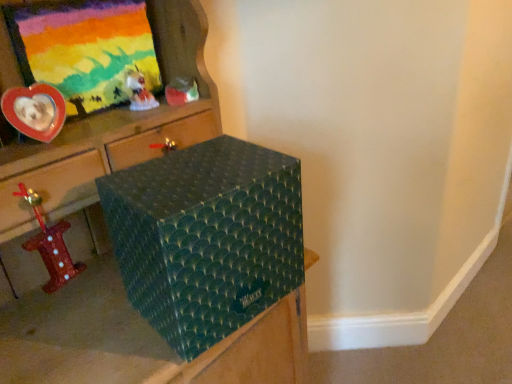
Describe the element at coordinates (50, 244) in the screenshot. I see `metallic red number one at left, positioned as the third toy in right-to-left order` at that location.

What is the approximate height of matte plastic toy at upper center, placed as the third toy when sorted from bottom to top?

matte plastic toy at upper center, placed as the third toy when sorted from bottom to top, is 1.97 inches tall.

In order to face matte plastic toy at upper center, placed as the third toy when sorted from bottom to top, should I rotate leftwards or rightwards?

It's best to rotate left around 9.557 degrees.

Image resolution: width=512 pixels, height=384 pixels. In order to click on translucent plastic figurine at upper center, which ranks as the second toy in left-to-right order in this screenshot , I will do `click(138, 91)`.

How much space does translucent plastic figurine at upper center, the 2th toy positioned from the back, occupy horizontally?

It is 2.09 inches.

Find the location of `green textured box at center`. green textured box at center is located at coordinates (166, 244).

You are a GUI agent. You are given a task and a screenshot of the screen. Output one action in this format:
    pyautogui.click(x=<x>, y=<y>)
    Task: Click on the teal textured box at center
    This screenshot has height=384, width=512.
    Given the screenshot: What is the action you would take?
    pyautogui.click(x=206, y=237)

Are matte plastic toy at upper center, placed as the 3th toy when sorted from front to back, and metallic red number one at left, positioned as the third toy in right-to-left order, beside each other?

No, matte plastic toy at upper center, placed as the 3th toy when sorted from front to back, is not next to metallic red number one at left, positioned as the third toy in right-to-left order.

Is matte plastic toy at upper center, positioned as the 3th toy in left-to-right order, taller or shorter than metallic red number one at left, arranged as the 3th toy when viewed from the back?

In the image, matte plastic toy at upper center, positioned as the 3th toy in left-to-right order, appears to be shorter than metallic red number one at left, arranged as the 3th toy when viewed from the back.

Is point (173, 88) closer or farther from the camera than point (66, 223)?

Clearly, point (173, 88) is more distant from the camera than point (66, 223).

Considering the relative sizes of matte plastic picture frame at upper left and teal textured box at center in the image provided, is matte plastic picture frame at upper left bigger than teal textured box at center?

Actually, matte plastic picture frame at upper left might be smaller than teal textured box at center.

Is matte plastic picture frame at upper left not close to teal textured box at center?

No, matte plastic picture frame at upper left is in close proximity to teal textured box at center.

Would you say teal textured box at center is part of matte plastic picture frame at upper left's contents?

That's incorrect, teal textured box at center is not inside matte plastic picture frame at upper left.

Is matte plastic picture frame at upper left positioned with its back to teal textured box at center?

No, matte plastic picture frame at upper left's orientation is not away from teal textured box at center.

Is green textured box at center with matte plastic toy at upper center, placed as the first toy when sorted from back to front?

No, green textured box at center is not touching matte plastic toy at upper center, placed as the first toy when sorted from back to front.

How far apart are green textured box at center and matte plastic toy at upper center, placed as the 3th toy when sorted from front to back?

13.93 inches.

Is matte plastic toy at upper center, which is the first toy in right-to-left order, a part of green textured box at center?

Absolutely, matte plastic toy at upper center, which is the first toy in right-to-left order, is inside green textured box at center.

Consider the image. Considering the sizes of green textured box at center and matte plastic toy at upper center, which is counted as the 1th toy, starting from the top, in the image, is green textured box at center wider or thinner than matte plastic toy at upper center, which is counted as the 1th toy, starting from the top,?

Considering their sizes, green textured box at center looks broader than matte plastic toy at upper center, which is counted as the 1th toy, starting from the top.

Is translucent plastic figurine at upper center, which appears as the second toy when viewed from the top, not inside matte plastic toy at upper center, which is counted as the 1th toy, starting from the top?

Yes, translucent plastic figurine at upper center, which appears as the second toy when viewed from the top, is outside of matte plastic toy at upper center, which is counted as the 1th toy, starting from the top.

Considering the positions of objects translucent plastic figurine at upper center, the 2th toy positioned from the back, and matte plastic toy at upper center, which is counted as the 1th toy, starting from the top, in the image provided, who is more to the right, translucent plastic figurine at upper center, the 2th toy positioned from the back, or matte plastic toy at upper center, which is counted as the 1th toy, starting from the top,?

From the viewer's perspective, matte plastic toy at upper center, which is counted as the 1th toy, starting from the top, appears more on the right side.

Is the surface of translucent plastic figurine at upper center, the 2th toy positioned from the back, in direct contact with matte plastic toy at upper center, which is counted as the 1th toy, starting from the top?

Yes, translucent plastic figurine at upper center, the 2th toy positioned from the back, is in contact with matte plastic toy at upper center, which is counted as the 1th toy, starting from the top.

From a real-world perspective, which object rests below the other?

In real-world perspective, matte plastic toy at upper center, placed as the third toy when sorted from bottom to top, is lower.

From a real-world perspective, relative to teal textured box at center, is matte plastic toy at upper center, placed as the 3th toy when sorted from front to back, vertically above or below?

matte plastic toy at upper center, placed as the 3th toy when sorted from front to back, is above teal textured box at center.

Which is more to the left, matte plastic toy at upper center, which is the first toy in right-to-left order, or teal textured box at center?

Positioned to the left is matte plastic toy at upper center, which is the first toy in right-to-left order.

Consider the image. Considering the relative sizes of matte plastic toy at upper center, which is the first toy in right-to-left order, and teal textured box at center in the image provided, is matte plastic toy at upper center, which is the first toy in right-to-left order, thinner than teal textured box at center?

Yes, matte plastic toy at upper center, which is the first toy in right-to-left order, is thinner than teal textured box at center.

From their relative heights in the image, would you say matte plastic toy at upper center, positioned as the 3th toy in left-to-right order, is taller or shorter than teal textured box at center?

Clearly, matte plastic toy at upper center, positioned as the 3th toy in left-to-right order, is shorter compared to teal textured box at center.

Consider the image. From the image's perspective, is metallic red number one at left, which ranks as the 1th toy in bottom-to-top order, over matte plastic picture frame at upper left?

No, from the image's perspective, metallic red number one at left, which ranks as the 1th toy in bottom-to-top order, is not over matte plastic picture frame at upper left.

Considering the relative sizes of metallic red number one at left, marked as the 1th toy in a left-to-right arrangement, and matte plastic picture frame at upper left in the image provided, is metallic red number one at left, marked as the 1th toy in a left-to-right arrangement, smaller than matte plastic picture frame at upper left?

Indeed, metallic red number one at left, marked as the 1th toy in a left-to-right arrangement, has a smaller size compared to matte plastic picture frame at upper left.

Is metallic red number one at left, which ranks as the 1th toy in bottom-to-top order, wider than matte plastic picture frame at upper left?

Indeed, metallic red number one at left, which ranks as the 1th toy in bottom-to-top order, has a greater width compared to matte plastic picture frame at upper left.

Can you confirm if metallic red number one at left, marked as the 1th toy in a left-to-right arrangement, is taller than matte plastic picture frame at upper left?

Incorrect, the height of metallic red number one at left, marked as the 1th toy in a left-to-right arrangement, is not larger of that of matte plastic picture frame at upper left.

Which is less distant, (141, 269) or (78, 271)?

The point (141, 269) is in front.

Is teal textured box at center positioned in front of metallic red number one at left, which is counted as the third toy, starting from the top?

Yes.

Is metallic red number one at left, positioned as the third toy in right-to-left order, surrounded by teal textured box at center?

No, metallic red number one at left, positioned as the third toy in right-to-left order, is not a part of teal textured box at center.

From a real-world perspective, starting from the metallic red number one at left, which ranks as the 1th toy in bottom-to-top order, which toy is the 1st one vertically above it? Please provide its 2D coordinates.

[(181, 91)]

Where is `picture frame above the teal textured box at center (from the image's perspective)`? picture frame above the teal textured box at center (from the image's perspective) is located at coordinates (85, 49).

Considering their positions, is translucent plastic figurine at upper center, which is the 2th toy from bottom to top, positioned closer to teal textured box at center than matte plastic toy at upper center, positioned as the 3th toy in left-to-right order?

matte plastic toy at upper center, positioned as the 3th toy in left-to-right order, is positioned closer to the anchor teal textured box at center.

Based on their spatial positions, is green textured box at center or matte plastic picture frame at upper left further from metallic red number one at left, positioned as the third toy in right-to-left order?

Based on the image, matte plastic picture frame at upper left appears to be further to metallic red number one at left, positioned as the third toy in right-to-left order.

Looking at the image, which one is located closer to translucent plastic figurine at upper center, which ranks as the second toy in left-to-right order, matte plastic picture frame at upper left or metallic red number one at left, marked as the 1th toy in a left-to-right arrangement?

The object closer to translucent plastic figurine at upper center, which ranks as the second toy in left-to-right order, is matte plastic picture frame at upper left.

Considering their positions, is matte plastic picture frame at upper left positioned further to translucent plastic figurine at upper center, which is the 2th toy from bottom to top, than matte plastic toy at upper center, which is counted as the 1th toy, starting from the top?

matte plastic picture frame at upper left is positioned further to the anchor translucent plastic figurine at upper center, which is the 2th toy from bottom to top.

Which object lies further to the anchor point matte plastic toy at upper center, positioned as the 3th toy in left-to-right order, translucent plastic figurine at upper center, which ranks as the second toy in left-to-right order, or metallic red number one at left, which ranks as the 1th toy in bottom-to-top order?

metallic red number one at left, which ranks as the 1th toy in bottom-to-top order, is further to matte plastic toy at upper center, positioned as the 3th toy in left-to-right order.

Looking at the image, which one is located further to matte plastic picture frame at upper left, matte plastic toy at upper center, placed as the 3th toy when sorted from front to back, or metallic red number one at left, arranged as the 3th toy when viewed from the back?

The object further to matte plastic picture frame at upper left is metallic red number one at left, arranged as the 3th toy when viewed from the back.

Based on their spatial positions, is translucent plastic figurine at upper center, which appears as the second toy when viewed from the top, or teal textured box at center closer to metallic red number one at left, which is counted as the third toy, starting from the top?

teal textured box at center.

From the image, which object appears to be nearer to teal textured box at center, matte plastic toy at upper center, placed as the first toy when sorted from back to front, or matte plastic picture frame at upper left?

Based on the image, matte plastic toy at upper center, placed as the first toy when sorted from back to front, appears to be nearer to teal textured box at center.

I want to click on box between green textured box at center and translucent plastic figurine at upper center, which ranks as the second toy in left-to-right order, from front to back, so point(206,237).

Locate an element on the screen. The width and height of the screenshot is (512, 384). toy between matte plastic picture frame at upper left and matte plastic toy at upper center, placed as the first toy when sorted from back to front, in the horizontal direction is located at coordinates (138, 91).

What are the coordinates of `box between matte plastic picture frame at upper left and green textured box at center vertically` in the screenshot? It's located at pyautogui.click(x=206, y=237).

At what (x,y) coordinates should I click in order to perform the action: click on toy between matte plastic toy at upper center, placed as the first toy when sorted from back to front, and metallic red number one at left, marked as the 1th toy in a left-to-right arrangement, from top to bottom. Please return your answer as a coordinate pair (x, y). The image size is (512, 384). Looking at the image, I should click on (138, 91).